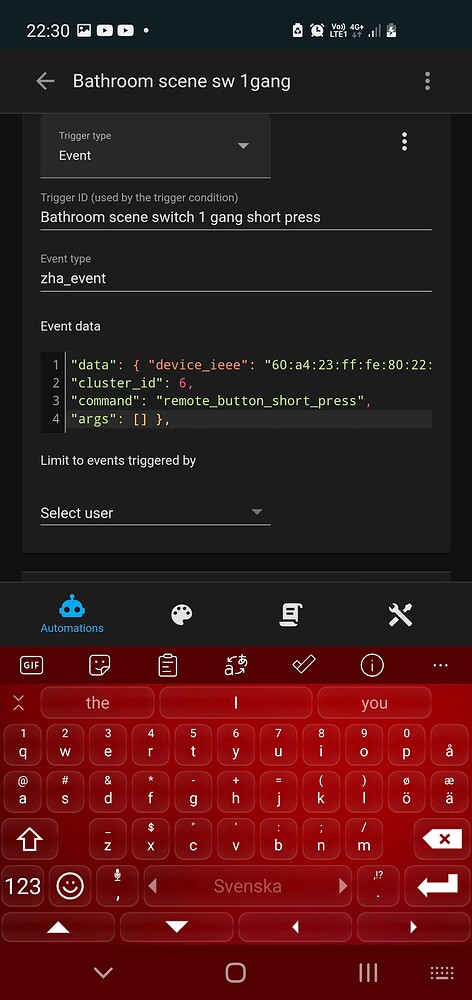
This screenshot has width=472, height=1000. What are the coordinates of `bathroom` in the screenshot? It's located at (99, 83).